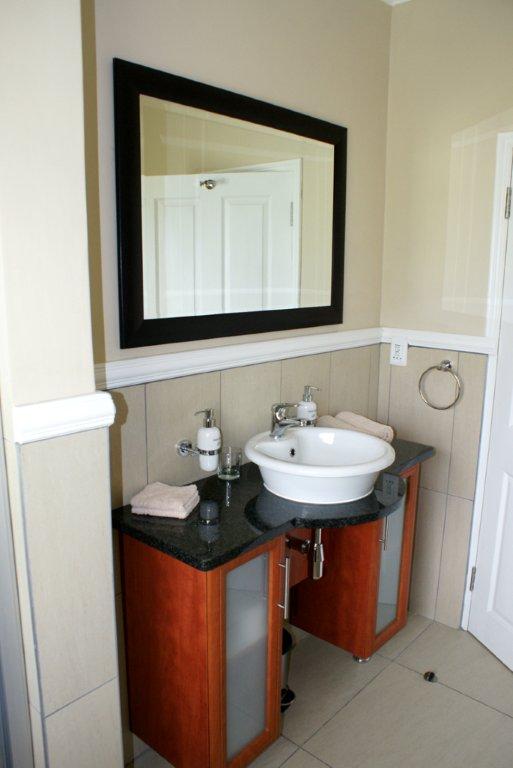
Locate an element on the screen. frame is located at coordinates (270, 111).